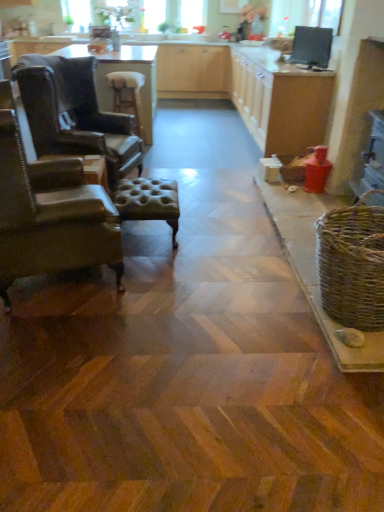
Question: From a real-world perspective, is woven brown basket at right positioned under matte wood counter top at center based on gravity?

Choices:
 (A) no
 (B) yes

Answer: (B)

Question: Is woven brown basket at right looking in the opposite direction of matte wood counter top at center?

Choices:
 (A) yes
 (B) no

Answer: (B)

Question: Is woven brown basket at right wider than matte wood counter top at center?

Choices:
 (A) no
 (B) yes

Answer: (A)

Question: From the image's perspective, is woven brown basket at right over matte wood counter top at center?

Choices:
 (A) yes
 (B) no

Answer: (B)

Question: Is woven brown basket at right at the left side of matte wood counter top at center?

Choices:
 (A) no
 (B) yes

Answer: (A)

Question: Is point (382, 318) closer or farther from the camera than point (137, 67)?

Choices:
 (A) closer
 (B) farther

Answer: (A)

Question: From a real-world perspective, is woven brown basket at right positioned above or below light brown wooden table at center?

Choices:
 (A) above
 (B) below

Answer: (B)

Question: Considering the relative positions of woven brown basket at right and light brown wooden table at center in the image provided, is woven brown basket at right to the left or to the right of light brown wooden table at center?

Choices:
 (A) left
 (B) right

Answer: (B)

Question: From the image's perspective, is woven brown basket at right located above or below light brown wooden table at center?

Choices:
 (A) below
 (B) above

Answer: (A)

Question: Is leather tufted stool at center, the 1th stool positioned from the right, situated inside light brown wooden table at center or outside?

Choices:
 (A) outside
 (B) inside

Answer: (A)

Question: From their relative heights in the image, would you say leather tufted stool at center, acting as the first stool starting from the front, is taller or shorter than light brown wooden table at center?

Choices:
 (A) tall
 (B) short

Answer: (B)

Question: Is leather tufted stool at center, which ranks as the first stool in bottom-to-top order, wider or thinner than light brown wooden table at center?

Choices:
 (A) thin
 (B) wide

Answer: (A)

Question: Considering their positions, is leather tufted stool at center, the 1th stool positioned from the right, located in front of or behind light brown wooden table at center?

Choices:
 (A) behind
 (B) front

Answer: (B)

Question: Is brown leather stool at center, which is the 2th stool from front to back, taller or shorter than matte wood counter top at center?

Choices:
 (A) short
 (B) tall

Answer: (A)

Question: Is brown leather stool at center, which is the 1th stool from left to right, wider or thinner than matte wood counter top at center?

Choices:
 (A) wide
 (B) thin

Answer: (B)